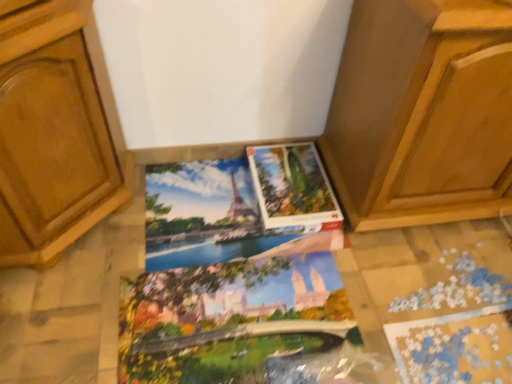
Question: From a real-world perspective, is matte cardboard puzzle at center located higher than wooden cabinet at center?

Choices:
 (A) no
 (B) yes

Answer: (A)

Question: Is matte cardboard puzzle at center at the right side of wooden cabinet at center?

Choices:
 (A) yes
 (B) no

Answer: (B)

Question: Is wooden cabinet at center inside matte cardboard puzzle at center?

Choices:
 (A) yes
 (B) no

Answer: (B)

Question: From the image's perspective, is matte cardboard puzzle at center on wooden cabinet at center?

Choices:
 (A) yes
 (B) no

Answer: (B)

Question: Is matte cardboard puzzle at center next to wooden cabinet at center and touching it?

Choices:
 (A) yes
 (B) no

Answer: (B)

Question: Is the position of matte cardboard puzzle at center more distant than that of wooden cabinet at center?

Choices:
 (A) no
 (B) yes

Answer: (B)

Question: Is wooden cabinet at center positioned with its back to matte paper coloring book at center, marked as the first coloring book in a bottom-to-top arrangement?

Choices:
 (A) yes
 (B) no

Answer: (B)

Question: Is there a large distance between wooden cabinet at center and matte paper coloring book at center, marked as the first coloring book in a bottom-to-top arrangement?

Choices:
 (A) yes
 (B) no

Answer: (B)

Question: From the image's perspective, is wooden cabinet at center located beneath matte paper coloring book at center, marked as the first coloring book in a bottom-to-top arrangement?

Choices:
 (A) no
 (B) yes

Answer: (A)

Question: Is wooden cabinet at center further to the viewer compared to matte paper coloring book at center, positioned as the 2th coloring book in top-to-bottom order?

Choices:
 (A) no
 (B) yes

Answer: (A)

Question: Does wooden cabinet at center lie in front of matte paper coloring book at center, marked as the first coloring book in a bottom-to-top arrangement?

Choices:
 (A) yes
 (B) no

Answer: (A)

Question: Is wooden cabinet at center aimed at matte paper coloring book at center, positioned as the 2th coloring book in top-to-bottom order?

Choices:
 (A) no
 (B) yes

Answer: (A)

Question: From a real-world perspective, is matte paper coloring book at center, positioned as the 2th coloring book in top-to-bottom order, located beneath matte cardboard puzzle at center?

Choices:
 (A) yes
 (B) no

Answer: (A)